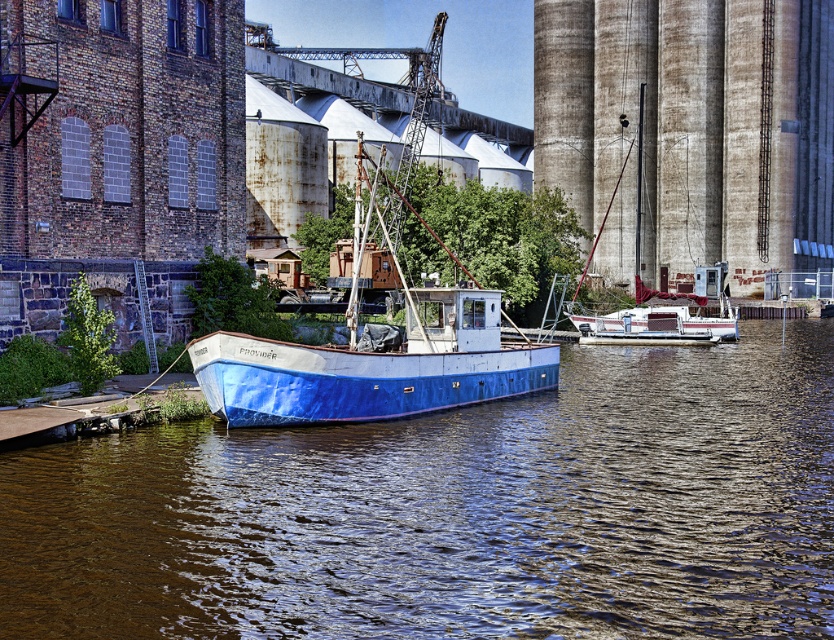
You are standing at the edge of the waterfront scene. You see a point marked at coordinates (374,368). Which object from the scene does this point belong to?

The point at coordinates (374,368) is on the blue matte boat at center.

You are standing at the shore looking at the waterfront scene. There are two points marked in the image. The first point is at coordinates point (410,314) and the second point is at point (589,324). Which point is closer to you?

Point (410,314) is in front of point (589,324), so it is closer to you.

You are standing at the shore looking towards the silos. There are two points marked in the image, point A at coordinates point(626, 404) and point B at coordinates point(380, 364). Which point is closer to you?

Point B at coordinates point(380, 364) is closer to you because it is in front of point A at coordinates point(626, 404).